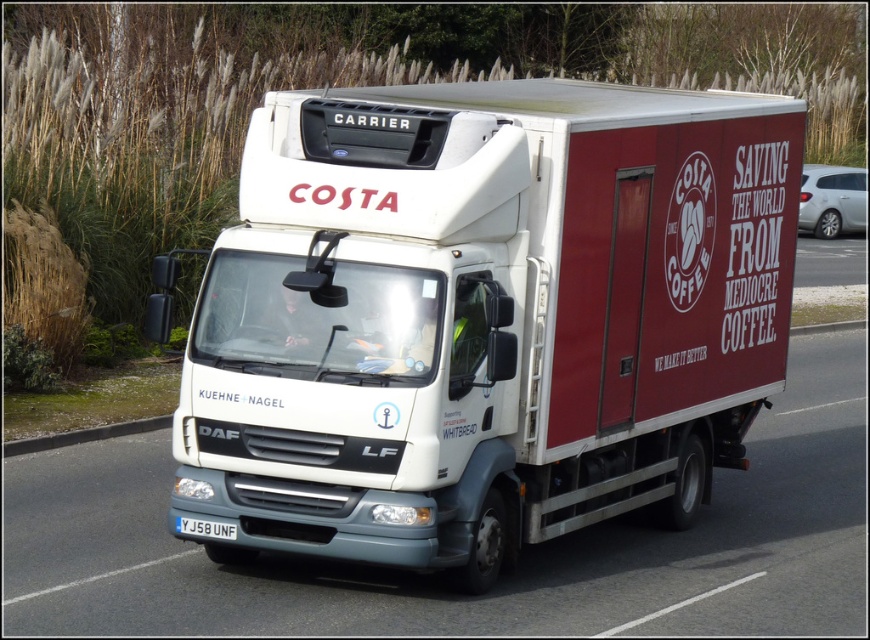
Question: Is white matte truck at center to the left of white plastic license plate at center from the viewer's perspective?

Choices:
 (A) yes
 (B) no

Answer: (B)

Question: Does white matte truck at center have a lesser width compared to white plastic license plate at center?

Choices:
 (A) yes
 (B) no

Answer: (B)

Question: Which point appears closest to the camera in this image?

Choices:
 (A) (181, 531)
 (B) (383, 182)

Answer: (B)

Question: Is white matte truck at center bigger than white plastic license plate at center?

Choices:
 (A) yes
 (B) no

Answer: (A)

Question: Among these points, which one is nearest to the camera?

Choices:
 (A) (212, 538)
 (B) (403, 483)

Answer: (B)